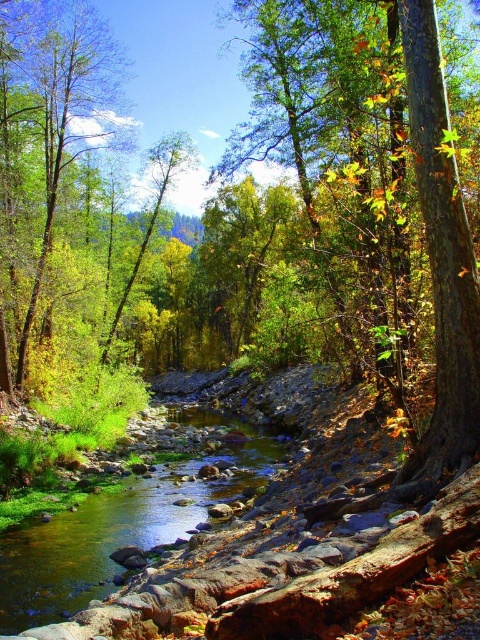
You are standing at the edge of the river and see the point marked at coordinates [117,529]. What is located at that point?

The point at coordinates [117,529] indicates clear water at stream center.

What is the 2D coordinate of the clear water at stream center in the image?

The clear water at stream center is located at the 2D coordinate point of [117,529].

You are standing on the riverbank and want to cross the river to the other side. You see the clear water at stream center and the green leafy tree at center. Which object is shorter and can help you step over?

The clear water at stream center is shorter than the green leafy tree at center, so you can step over the clear water at stream center.